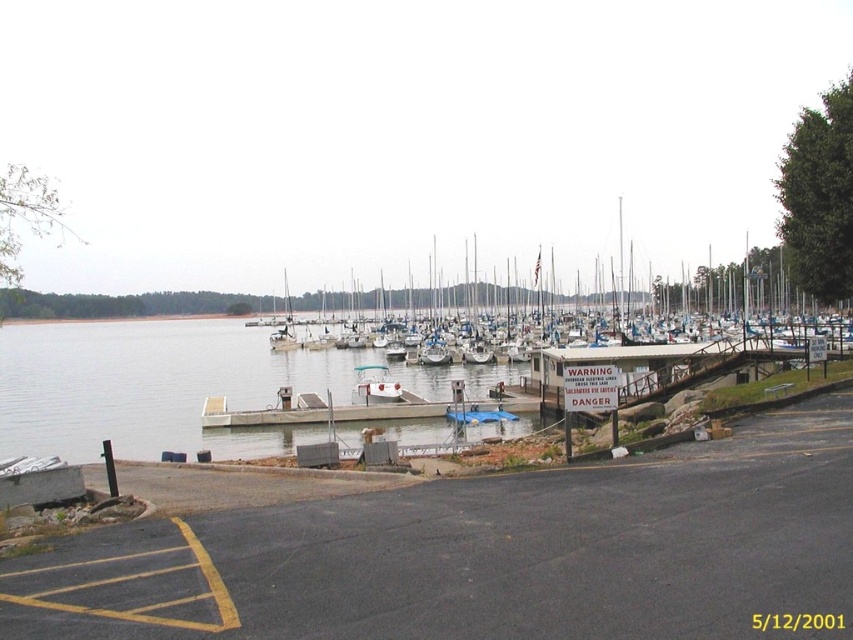
Who is lower down, black asphalt parking lot at lower left or white matte boats at center?

black asphalt parking lot at lower left is below.

Who is more forward, (x=553, y=509) or (x=711, y=288)?

Point (x=553, y=509)

Does point (582, 497) lie in front of point (717, 296)?

Yes, point (582, 497) is in front of point (717, 296).

Image resolution: width=853 pixels, height=640 pixels. Identify the location of black asphalt parking lot at lower left. (494, 554).

Is point (669, 548) farther from viewer compared to point (381, 397)?

No, it is not.

Can you confirm if black asphalt parking lot at lower left is positioned below white matte sailboat at center?

No.

Which is behind, point (498, 499) or point (387, 385)?

Positioned behind is point (387, 385).

Where is `black asphalt parking lot at lower left`? The image size is (853, 640). black asphalt parking lot at lower left is located at coordinates (494, 554).

Measure the distance between point (759,289) and camera.

Point (759,289) is 110.34 meters away from camera.

Can you confirm if white matte boats at center is positioned to the left of white matte sailboat at center?

No, white matte boats at center is not to the left of white matte sailboat at center.

Describe the element at coordinates (741, 296) in the screenshot. The width and height of the screenshot is (853, 640). I see `white matte boats at center` at that location.

Identify the location of white matte boats at center. [741, 296].